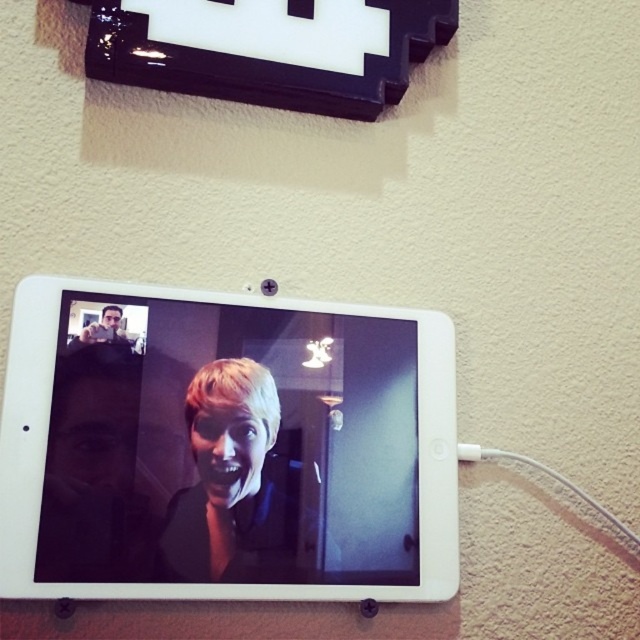
Does point (177, 362) come behind point (80, 348)?

That is True.

This screenshot has height=640, width=640. What do you see at coordinates (225, 449) in the screenshot?
I see `white glossy tablet at center` at bounding box center [225, 449].

The image size is (640, 640). What are the coordinates of `white glossy tablet at center` in the screenshot? It's located at (225, 449).

Which is more to the right, matte black face at left or matte black face at upper left?

matte black face at left is more to the right.

Does matte black face at left appear under matte black face at upper left?

Correct, matte black face at left is located below matte black face at upper left.

Between point (52, 516) and point (108, 323), which one is positioned behind?

Point (108, 323)

This screenshot has height=640, width=640. I want to click on matte black face at left, so click(93, 472).

Does white glossy tablet at center have a larger size compared to matte black face at left?

Yes.

Who is taller, white glossy tablet at center or matte black face at left?

Standing taller between the two is white glossy tablet at center.

Between point (348, 349) and point (65, 532), which one is positioned in front?

Point (65, 532) is in front.

Locate an element on the screen. Image resolution: width=640 pixels, height=640 pixels. white glossy tablet at center is located at coordinates click(x=225, y=449).